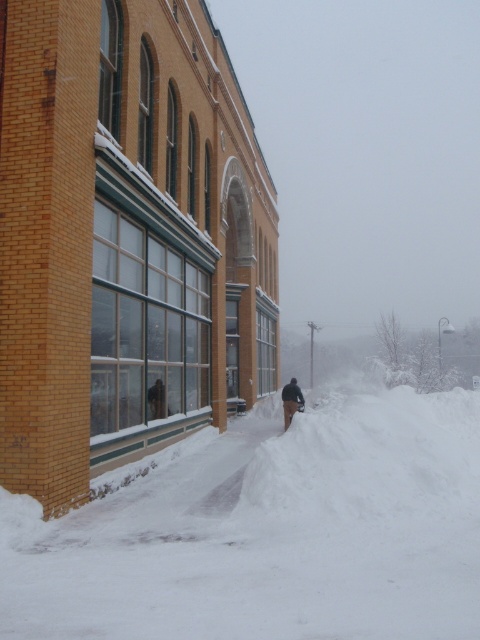
From the picture: You are a delivery person trying to navigate through the snowy path. The white fluffy snow at lower center and the dark brown fur coat at lower center are in your way. Which one is wider so you can decide where to step?

The white fluffy snow at lower center is wider than the dark brown fur coat at lower center, so you should step towards the narrower dark brown fur coat at lower center to navigate safely.

You are a delivery person trying to walk through the path between the two snow mounds. You see the white fluffy snow at lower center and the dark brown fur coat at lower center. Which object is bigger in size?

The white fluffy snow at lower center has a larger size compared to the dark brown fur coat at lower center, so the white fluffy snow at lower center is bigger in size.